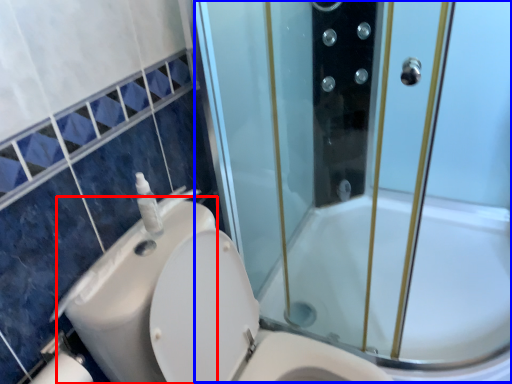
Question: Which point is further to the camera, sink (highlighted by a red box) or screen door (highlighted by a blue box)?

Choices:
 (A) sink
 (B) screen door

Answer: (A)